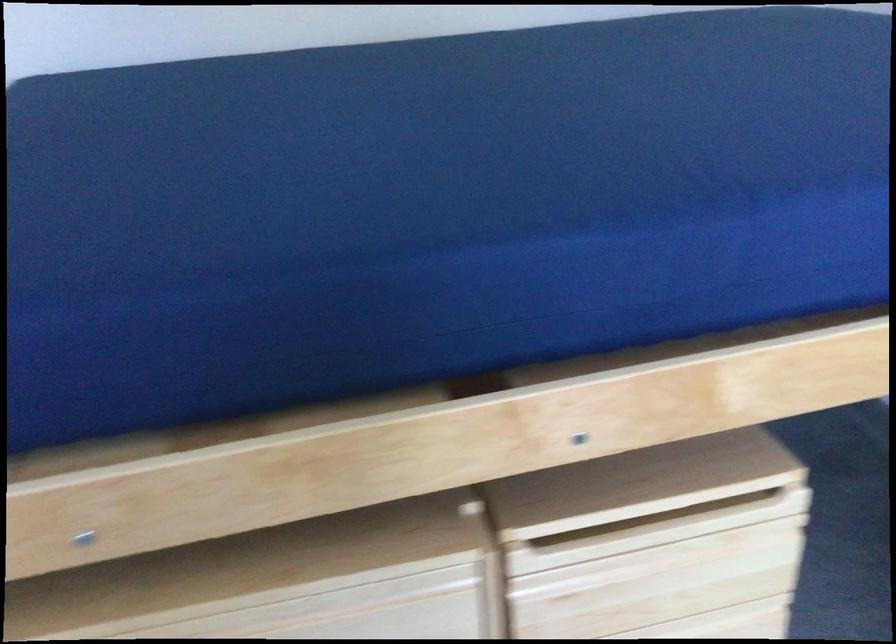
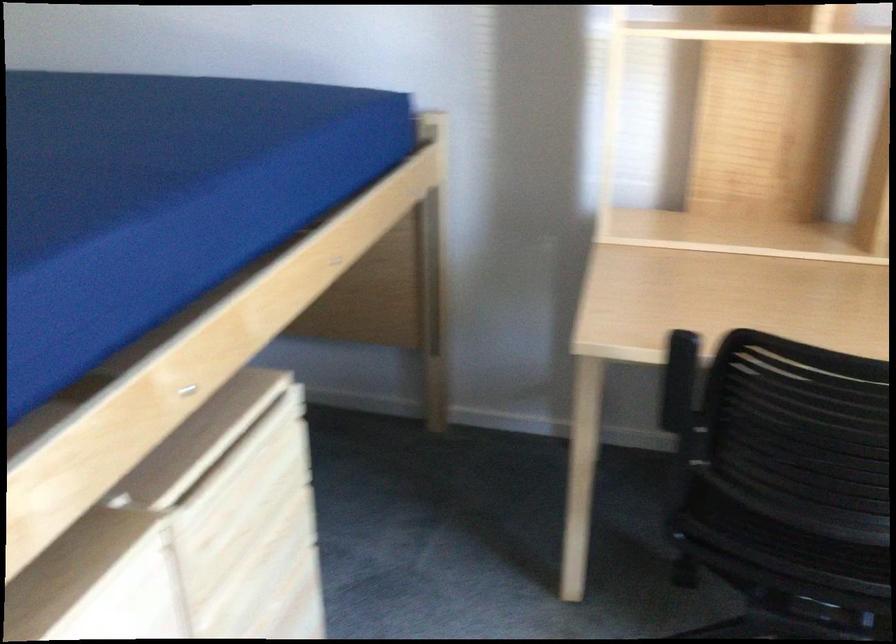
Question: The camera is either moving clockwise (left) or counter-clockwise (right) around the object. The first image is from the beginning of the video and the second image is from the end. Is the camera moving left or right when shooting the video?

Choices:
 (A) Left
 (B) Right

Answer: (A)